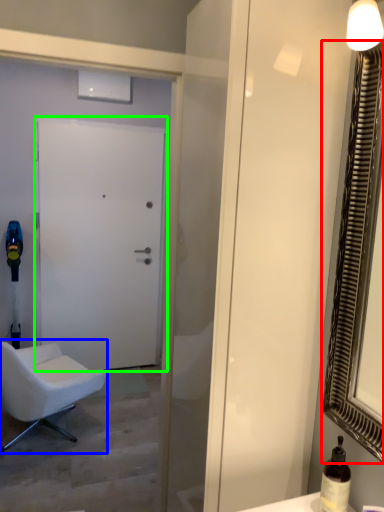
Question: Which object is the closest to the mirror (highlighted by a red box)? Choose among these: chair (highlighted by a blue box) or door (highlighted by a green box).

Choices:
 (A) chair
 (B) door

Answer: (A)